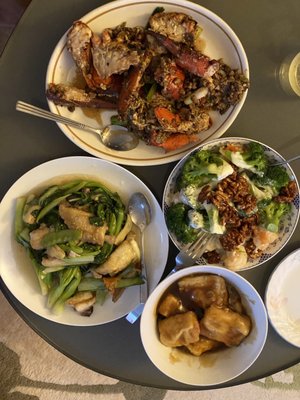
Locate an element on the screen. medium bowl is located at coordinates (159, 244).